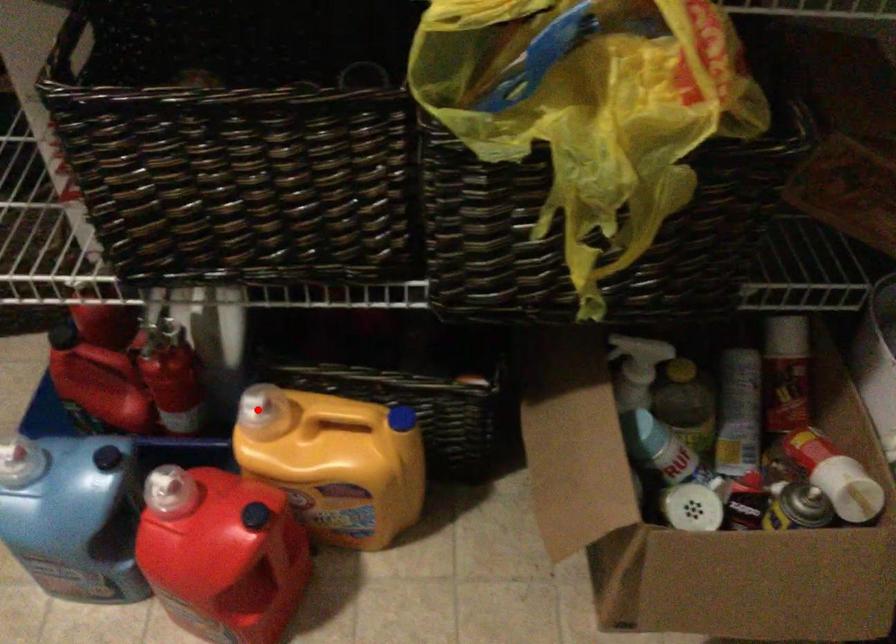
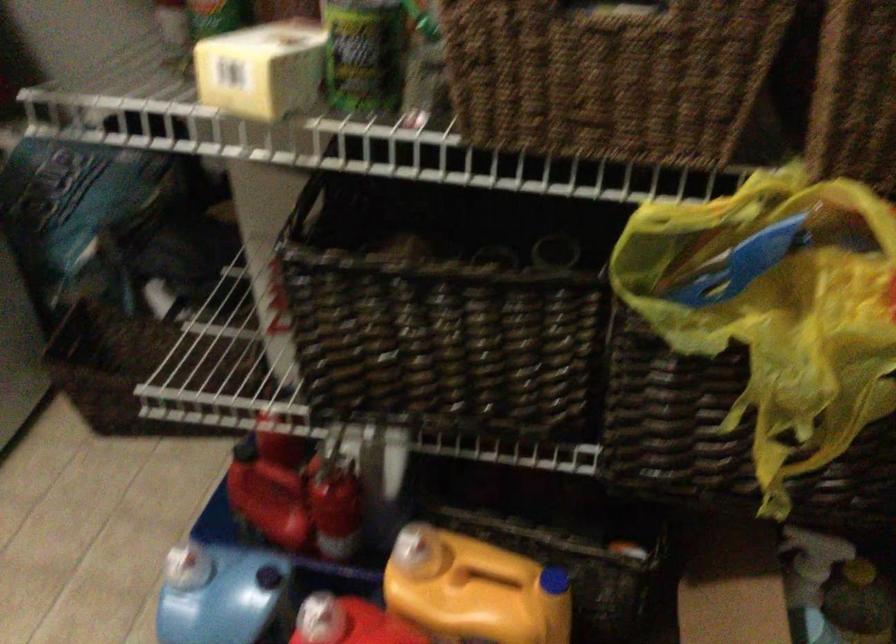
Find the pixel in the second image that matches the highlighted location in the first image.

(409, 550)